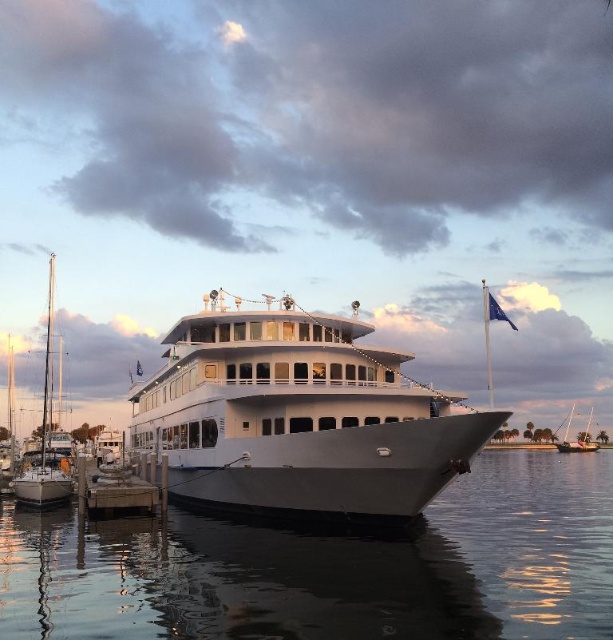
Question: Which point is closer to the camera?

Choices:
 (A) click(587, 432)
 (B) click(18, 481)
 (C) click(321, 408)
 (D) click(444, 589)

Answer: (D)

Question: Does white glossy yacht at center lie behind white glossy sailboat at lower right?

Choices:
 (A) no
 (B) yes

Answer: (A)

Question: Does white glossy yacht at center appear under wooden dock at lower left?

Choices:
 (A) yes
 (B) no

Answer: (B)

Question: Where is white glossy yacht at center located in relation to white glossy sailboat at left in the image?

Choices:
 (A) below
 (B) above

Answer: (B)

Question: Estimate the real-world distances between objects in this image. Which object is farther from the white glossy sailboat at left?

Choices:
 (A) white glossy sailboat at lower right
 (B) white glossy yacht at center

Answer: (A)

Question: Which point appears closest to the camera in this image?

Choices:
 (A) (581, 449)
 (B) (311, 400)
 (C) (153, 486)
 (D) (550, 509)

Answer: (B)